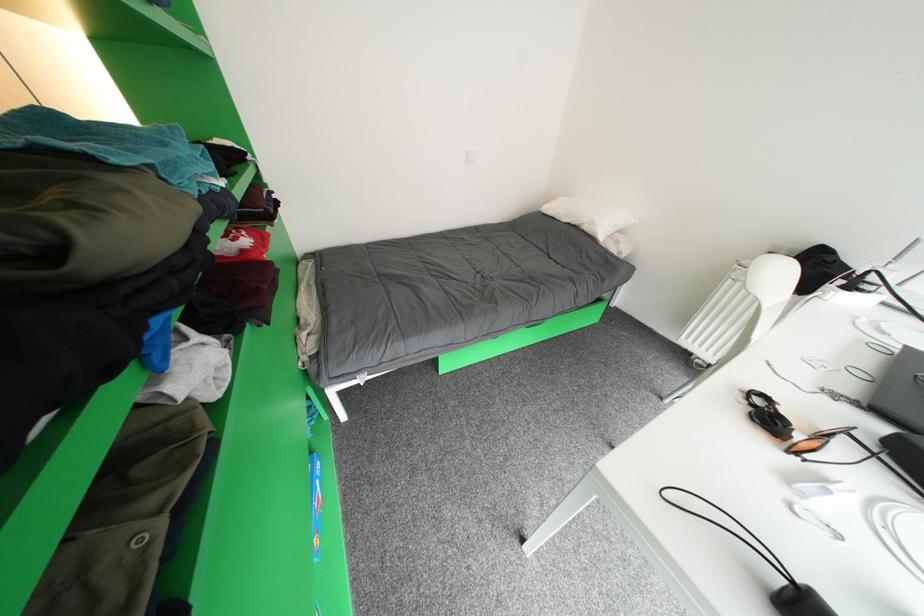
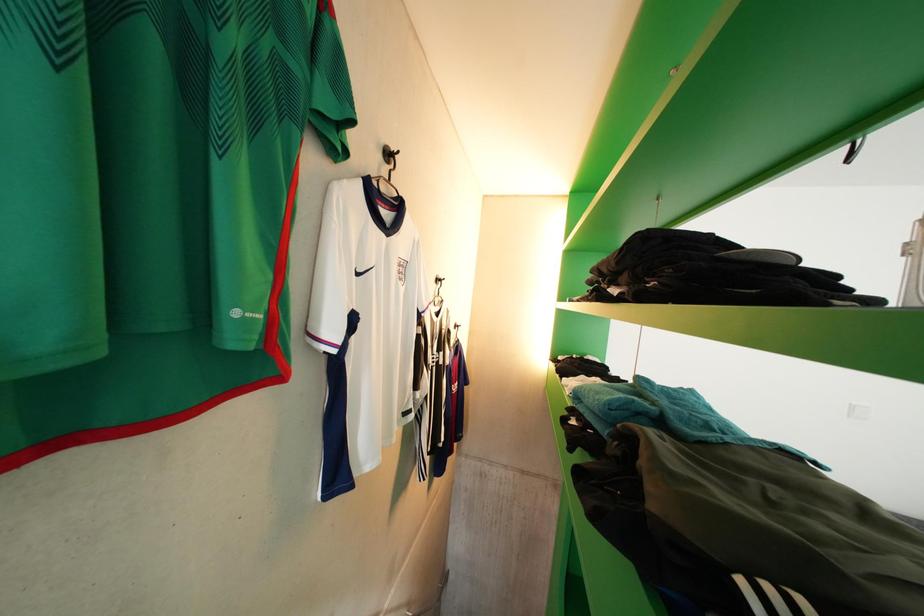
Based on the continuous images, in which direction is the camera rotating?

The camera's rotation is toward left-up.